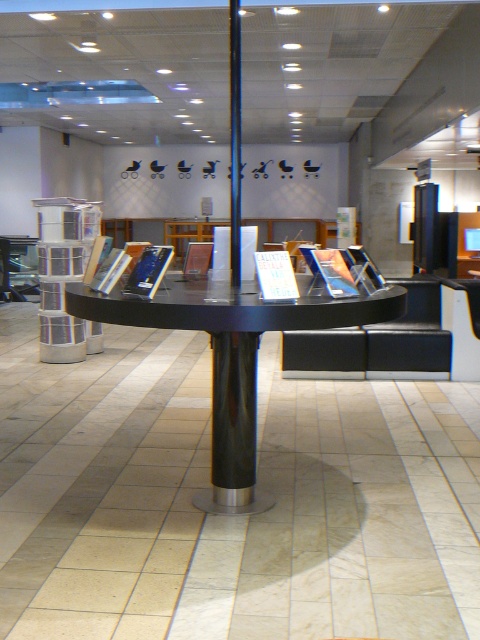
Between metallic cylindrical stack at left and black glossy pillar at center, which one has less height?

metallic cylindrical stack at left is shorter.

Who is lower down, metallic cylindrical stack at left or black glossy pillar at center?

metallic cylindrical stack at left is below.

Does point (84, 266) lie in front of point (414, 259)?

Yes, it is in front of point (414, 259).

Find the location of a particular element. metallic cylindrical stack at left is located at coordinates (62, 272).

Can you confirm if black glossy table at center is wider than black glossy pillar at center?

Correct, the width of black glossy table at center exceeds that of black glossy pillar at center.

Is black glossy table at center bigger than black glossy pillar at center?

Yes, black glossy table at center is bigger than black glossy pillar at center.

Between point (253, 284) and point (414, 262), which one is positioned behind?

The point (414, 262) is behind.

Locate an element on the screen. black glossy table at center is located at coordinates (232, 356).

Who is positioned more to the right, black glossy table at center or metallic cylindrical stack at left?

black glossy table at center is more to the right.

Does point (299, 307) come in front of point (68, 232)?

Yes, point (299, 307) is in front of point (68, 232).

Who is more distant from viewer, (x=392, y=304) or (x=82, y=208)?

Point (x=82, y=208)

You are a GUI agent. You are given a task and a screenshot of the screen. Output one action in this format:
    pyautogui.click(x=<x>, y=<y>)
    Task: Click on the black glossy table at center
    
    Given the screenshot: What is the action you would take?
    pyautogui.click(x=232, y=356)